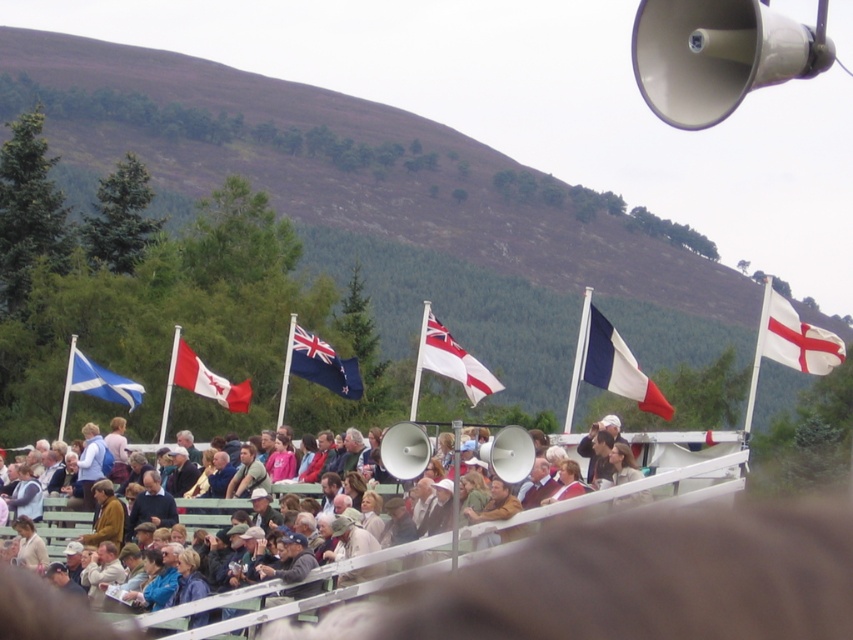
Question: Among these objects, which one is farthest from the camera?

Choices:
 (A) white/blue/red fabric flag at center
 (B) white fabric flag at upper right
 (C) red/white fabric flag at center
 (D) blue fabric flag at center

Answer: (C)

Question: Which object is farther from the camera taking this photo?

Choices:
 (A) white fabric flag at center
 (B) blue and white fabric flag at left
 (C) blue fabric flag at center

Answer: (B)

Question: Can you confirm if light brown leather jacket at center is positioned above white fabric flag at upper right?

Choices:
 (A) no
 (B) yes

Answer: (A)

Question: Can you confirm if white fabric flag at upper right is thinner than white/blue/red fabric flag at center?

Choices:
 (A) no
 (B) yes

Answer: (B)

Question: Estimate the real-world distances between objects in this image. Which object is closer to the white plastic megaphone at upper right?

Choices:
 (A) white fabric flag at upper right
 (B) white/blue/red fabric flag at center
 (C) blue fabric flag at center
 (D) light brown leather jacket at center

Answer: (A)

Question: Can you confirm if white plastic megaphone at upper right is positioned above white fabric flag at upper right?

Choices:
 (A) yes
 (B) no

Answer: (A)